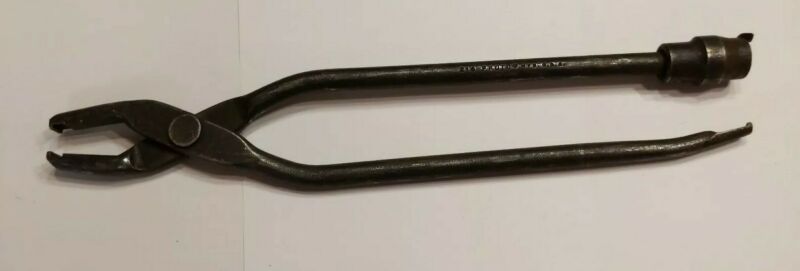
The width and height of the screenshot is (800, 271). What are the coordinates of `upper handle` in the screenshot? It's located at (494, 63).